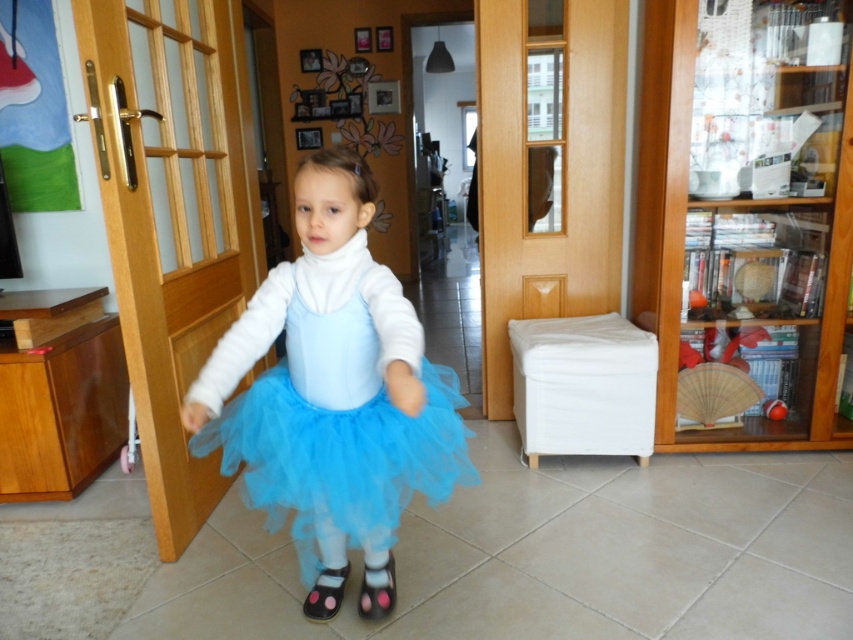
What is the exact 2D coordinate of the tulle skirt at center in the image?

The exact 2D coordinate of the tulle skirt at center is at point (339, 458).

The child is wearing a tulle skirt at center and a pink fabric shoe at lower center. Which item is wider?

The tulle skirt at center is wider than the pink fabric shoe at lower center because the tulle skirt at center surpasses the pink fabric shoe at lower center in width.